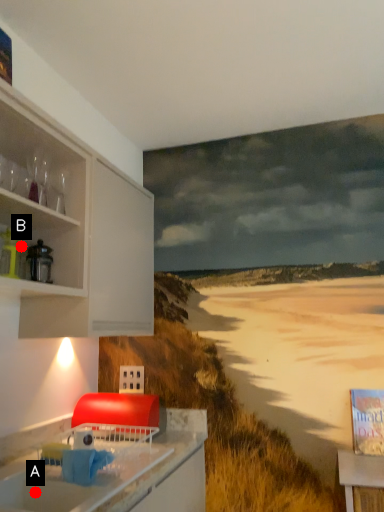
Question: Two points are circled on the image, labeled by A and B beside each circle. Among these points, which one is farthest from the camera?

Choices:
 (A) A is further
 (B) B is further

Answer: (B)